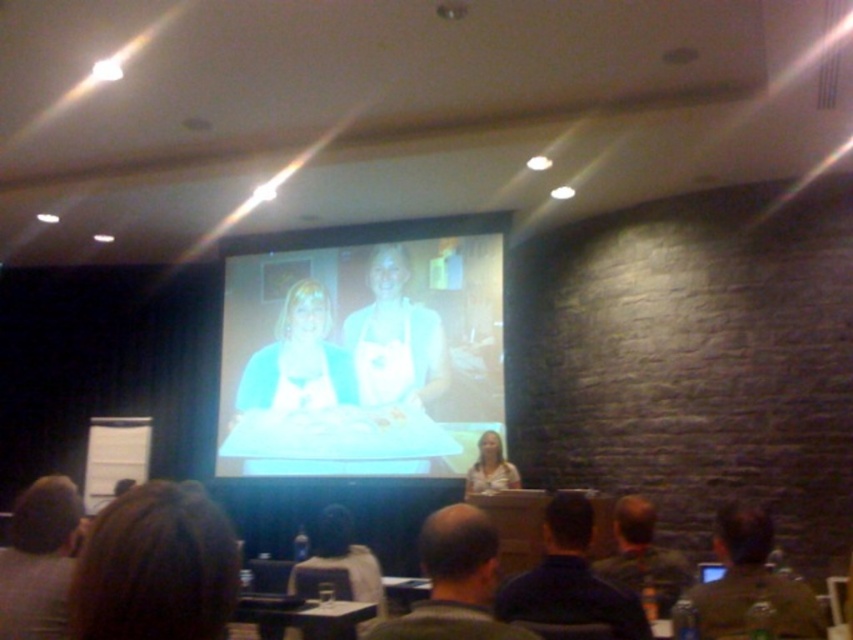
Question: Estimate the real-world distances between objects in this image. Which object is farther from the matte white screen at center?

Choices:
 (A) dark brown hair at center
 (B) brown hair at lower left
 (C) dark green shirt at lower right
 (D) dark blue shirt at lower center

Answer: (B)

Question: Does brown hair at lower left have a lesser width compared to brown hair at upper left?

Choices:
 (A) no
 (B) yes

Answer: (B)

Question: Is matte white screen at center further to the viewer compared to bald head at center?

Choices:
 (A) yes
 (B) no

Answer: (A)

Question: Does brown hair at upper left appear under dark green shirt at lower right?

Choices:
 (A) yes
 (B) no

Answer: (B)

Question: Among these objects, which one is nearest to the camera?

Choices:
 (A) dark brown hair at center
 (B) brown hair at upper left
 (C) bald head at center
 (D) dark green shirt at lower right

Answer: (C)

Question: Which is nearer to the bald head at center?

Choices:
 (A) dark blue shirt at lower center
 (B) brown hair at lower left
 (C) brown hair at upper left

Answer: (A)